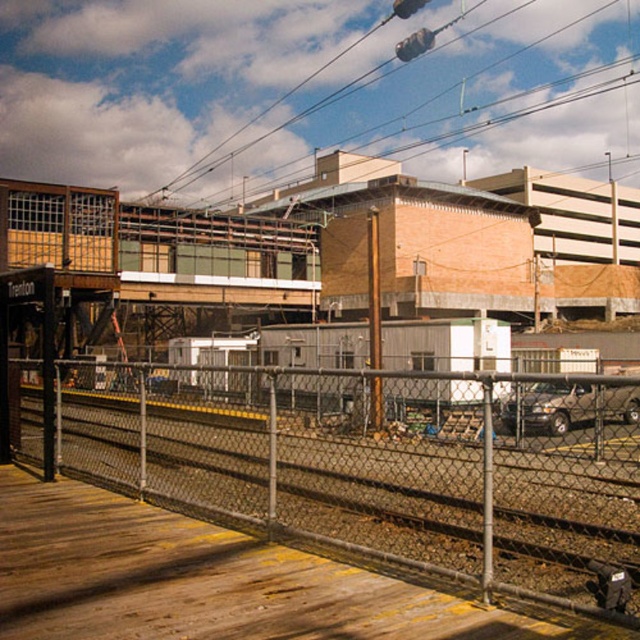
Find the location of a particular element. The width and height of the screenshot is (640, 640). metal chain-link fence at center is located at coordinates (390, 468).